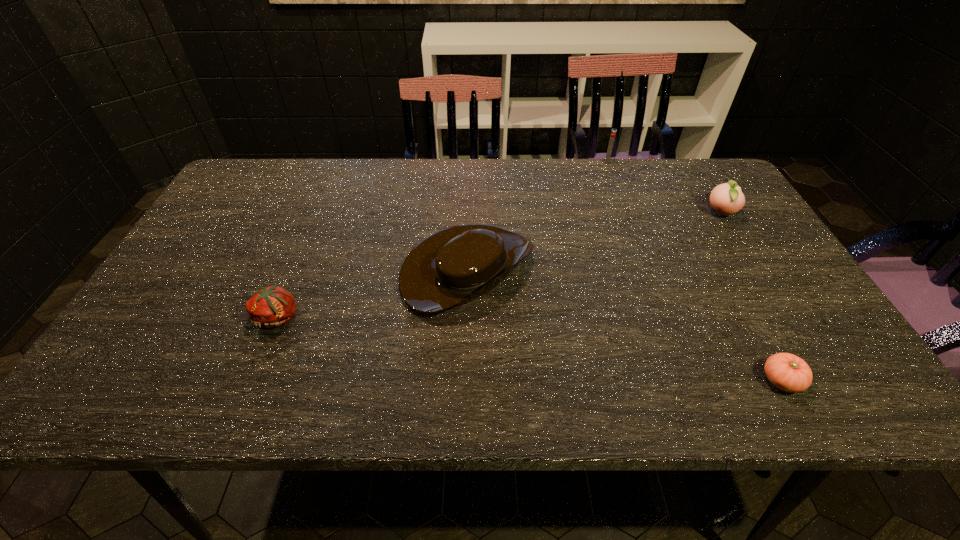
Locate an element on the screen. vacant point that satisfies the following two spatial constraints: 1. on the front side of the cowboy hat; 2. on the left side of the right tomato is located at coordinates (465, 380).

The width and height of the screenshot is (960, 540). I want to click on free spot that satisfies the following two spatial constraints: 1. on the front side of the nearer tomato; 2. on the left side of the fourth object from right to left, so click(x=465, y=380).

The height and width of the screenshot is (540, 960). What are the coordinates of `vacant space that satisfies the following two spatial constraints: 1. on the front side of the second object from left to right; 2. on the left side of the nearer tomato` in the screenshot? It's located at (465, 380).